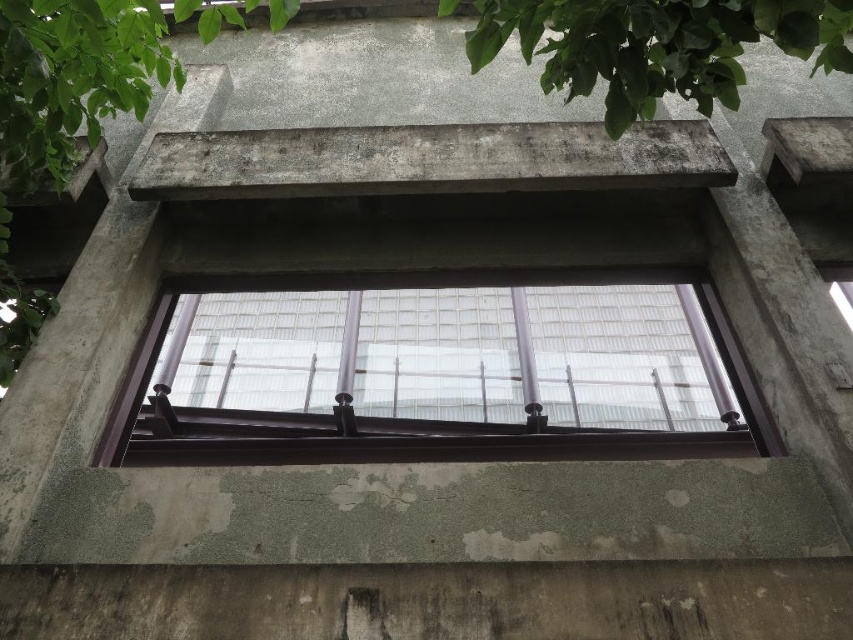
You are a window cleaner standing outside the building. You need to clean both the clear glass window at center and the green leafy tree at upper center. Which object should you clean first if you want to start with the one that is closer to your current position?

The clear glass window at center is to the right of green leafy tree at upper center, but their distance from you isn not specified in the description. Therefore, I cannot determine which is closer based on the provided information.